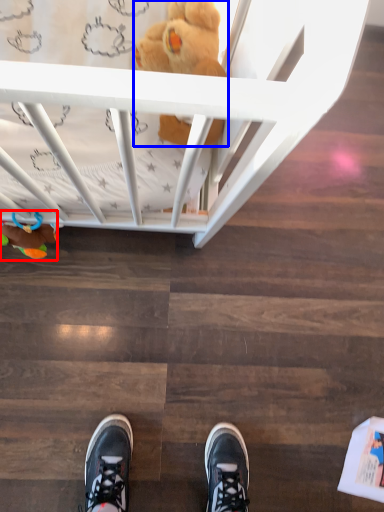
Question: Which object appears closest to the camera in this image, toy (highlighted by a red box) or toy (highlighted by a blue box)?

Choices:
 (A) toy
 (B) toy

Answer: (B)